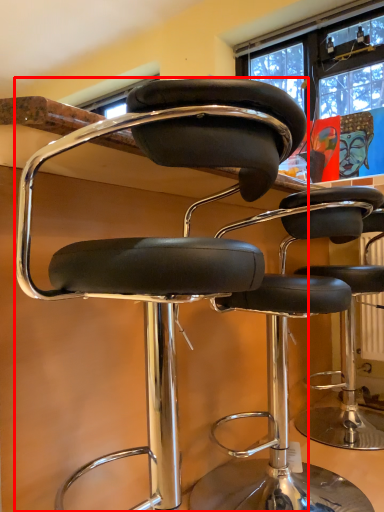
Question: From the image, what is the correct spatial relationship of chair (annotated by the red box) in relation to chair?

Choices:
 (A) right
 (B) left

Answer: (B)